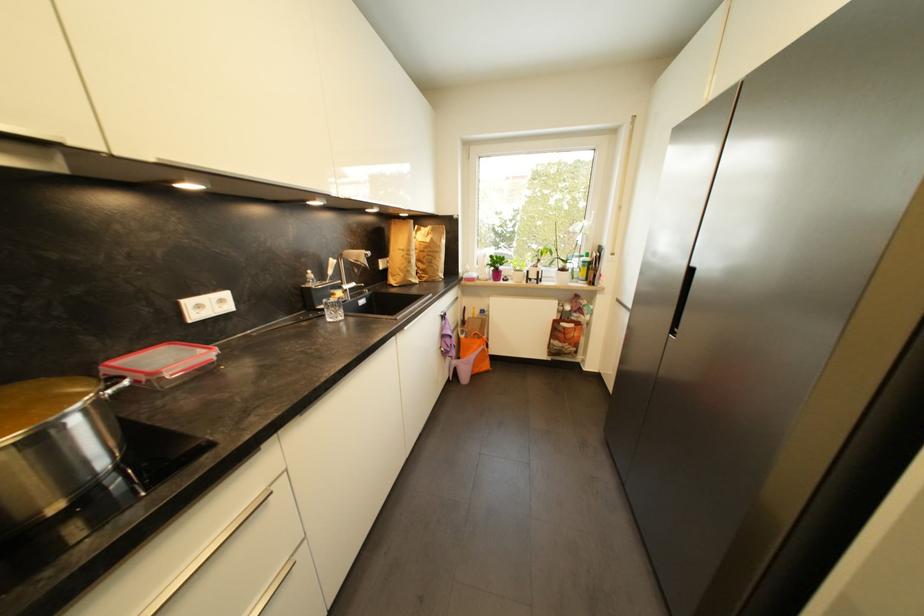
The location [495,265] corresponds to which object?

It refers to a pink flower pot.